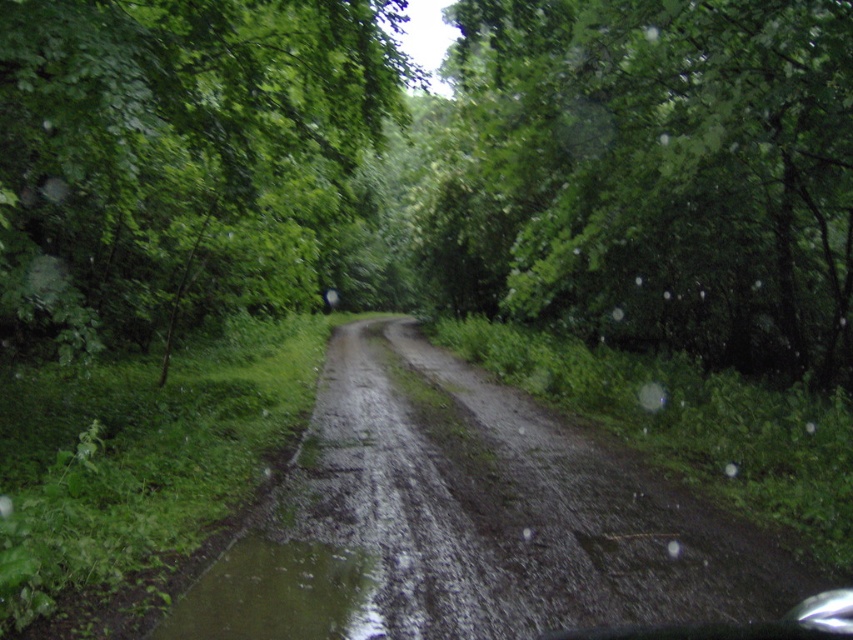
Does point (590, 481) come farther from viewer compared to point (279, 596)?

Yes, point (590, 481) is behind point (279, 596).

Is damp gravel path at center further to the viewer compared to green mud puddle at lower left?

Yes, it is behind green mud puddle at lower left.

Who is more distant from viewer, (573,566) or (270,593)?

Positioned behind is point (573,566).

The width and height of the screenshot is (853, 640). In order to click on damp gravel path at center in this screenshot , I will do `click(468, 522)`.

Is green leafy tree at upper center bigger than damp gravel path at center?

Indeed, green leafy tree at upper center has a larger size compared to damp gravel path at center.

Is point (779, 100) less distant than point (550, 468)?

Yes, point (779, 100) is closer to viewer.

At what (x,y) coordinates should I click in order to perform the action: click on green leafy tree at upper center. Please return your answer as a coordinate pair (x, y). The width and height of the screenshot is (853, 640). Looking at the image, I should click on (670, 170).

Does green leafy tree at upper center appear under green mud puddle at lower left?

Actually, green leafy tree at upper center is above green mud puddle at lower left.

Who is positioned more to the right, green leafy tree at upper center or green mud puddle at lower left?

From the viewer's perspective, green leafy tree at upper center appears more on the right side.

Does point (618, 88) come farther from viewer compared to point (178, 625)?

That is True.

Identify the location of green leafy tree at upper center. (670, 170).